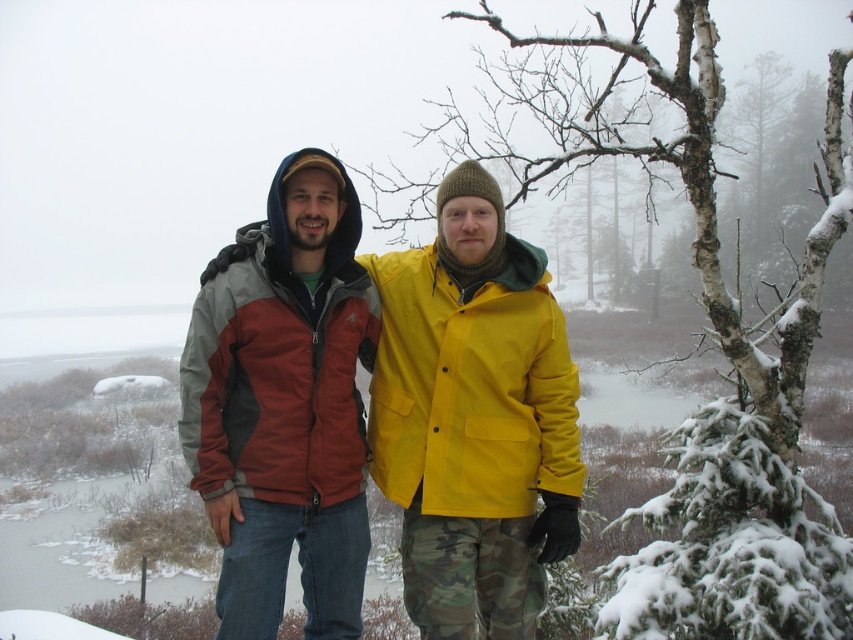
From the picture: You are standing in the snowy landscape and want to move from the point closer to you to the point further away. Which path should you take between the two points, point (345,308) and point (479,269)?

The point closer to you is point (345,308), so you should move towards point (479,269) which is further away.

You are standing at the origin point in the snowy landscape. There is a matte red jacket at center located at point (283,404). If you want to move towards the person on the right, who is wearing a bright yellow jacket, should you move to the left or right of the matte red jacket at center?

You should move to the right of the matte red jacket at center because the person on the right is positioned to the right side of the matte red jacket at center.